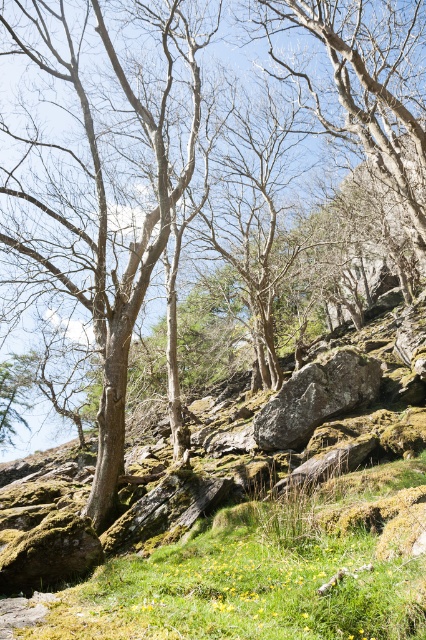
Is point (195, 566) positioned in front of point (347, 381)?

Yes, point (195, 566) is closer to viewer.

Is rocky mossy boulder at center closer to the viewer compared to green mossy rock at center?

Yes, rocky mossy boulder at center is in front of green mossy rock at center.

The image size is (426, 640). Identify the location of rocky mossy boulder at center. (259, 538).

This screenshot has height=640, width=426. In order to click on rocky mossy boulder at center in this screenshot , I will do `click(259, 538)`.